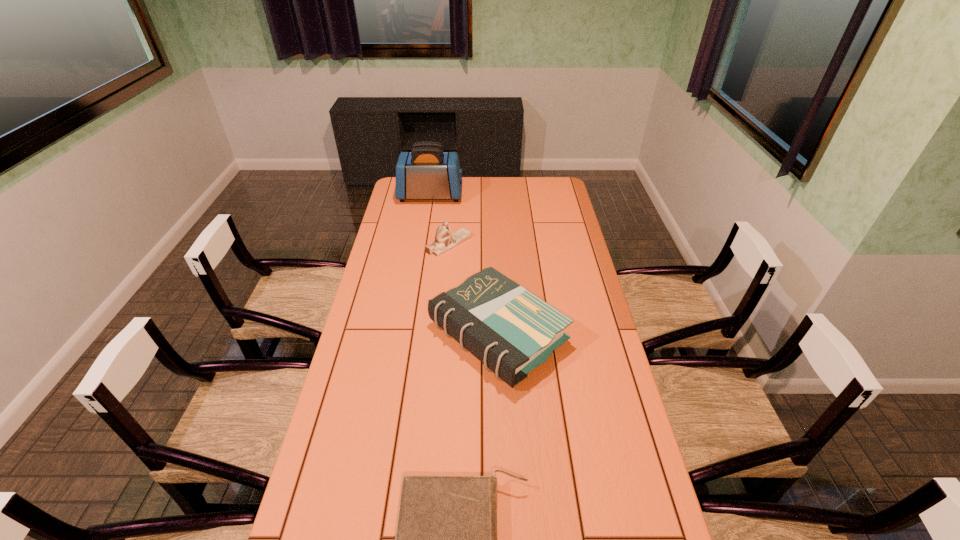
This screenshot has height=540, width=960. I want to click on vacant region that satisfies the following two spatial constraints: 1. on the front-facing side of the figurine; 2. on the left side of the taller paperback book, so click(x=442, y=334).

Locate an element on the screen. vacant area in the image that satisfies the following two spatial constraints: 1. on the front-facing side of the third nearest object; 2. on the right side of the farther paperback book is located at coordinates (442, 334).

The height and width of the screenshot is (540, 960). What are the coordinates of `free region that satisfies the following two spatial constraints: 1. on the front-facing side of the farthest object; 2. on the left side of the taller paperback book` in the screenshot? It's located at (408, 334).

You are a GUI agent. You are given a task and a screenshot of the screen. Output one action in this format:
    pyautogui.click(x=<x>, y=<y>)
    Task: Click on the free space that satisfies the following two spatial constraints: 1. on the front-facing side of the taller paperback book; 2. on the right side of the toaster
    
    Given the screenshot: What is the action you would take?
    pyautogui.click(x=408, y=334)

At what (x,y) coordinates should I click in order to perform the action: click on free spot that satisfies the following two spatial constraints: 1. on the back side of the farther paperback book; 2. on the front-facing side of the second farthest object. Please return your answer as a coordinate pair (x, y). The height and width of the screenshot is (540, 960). Looking at the image, I should click on (494, 244).